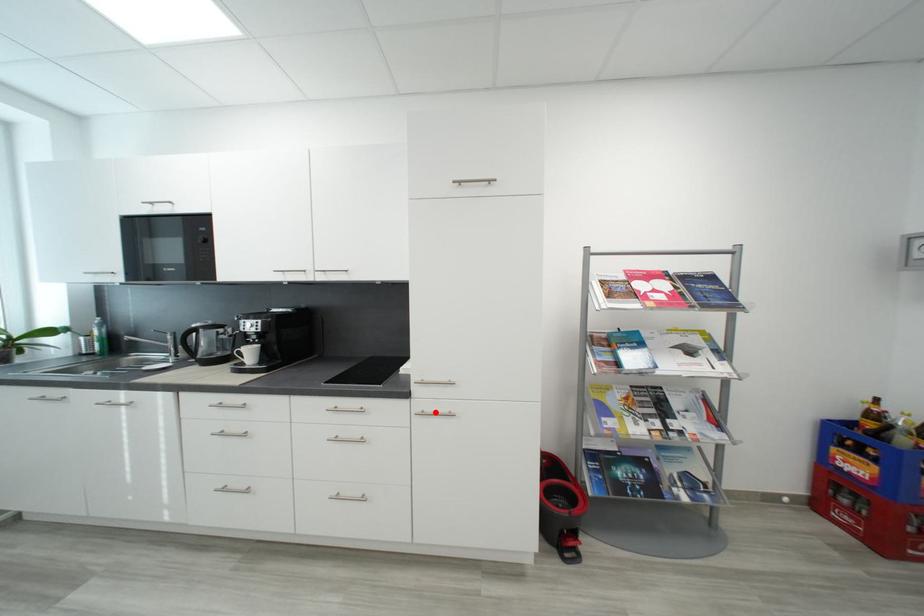
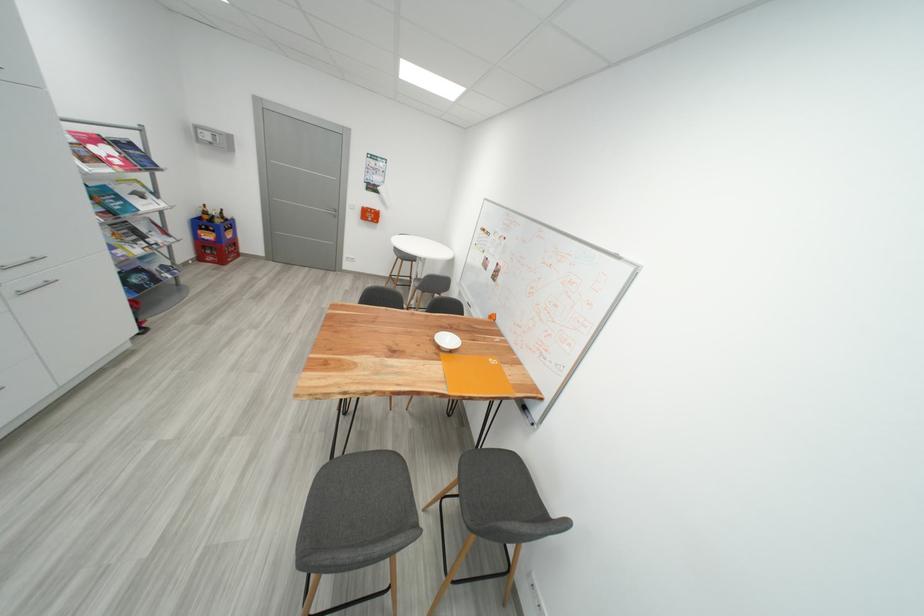
In the second image, find the point that corresponds to the highlighted location in the first image.

(30, 291)